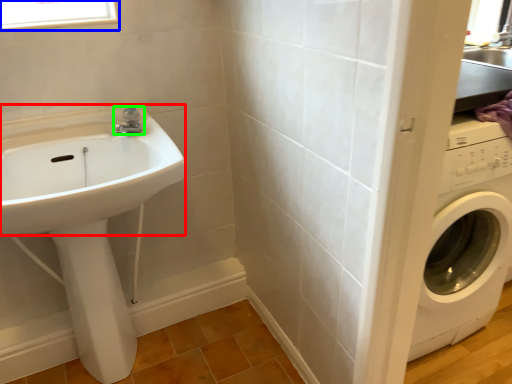
Question: Based on their relative distances, which object is nearer to sink (highlighted by a red box)? Choose from window (highlighted by a blue box) and tap (highlighted by a green box).

Choices:
 (A) window
 (B) tap

Answer: (B)